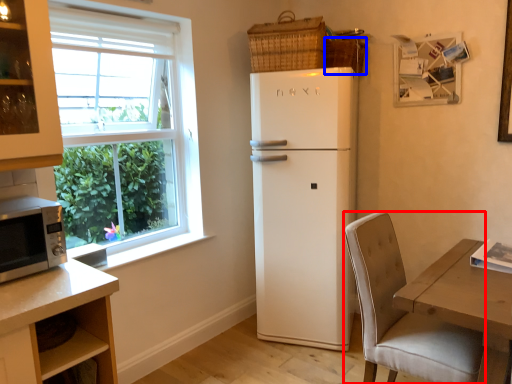
Question: Which of the following is the farthest to the observer, chair (highlighted by a red box) or basket (highlighted by a blue box)?

Choices:
 (A) chair
 (B) basket

Answer: (B)